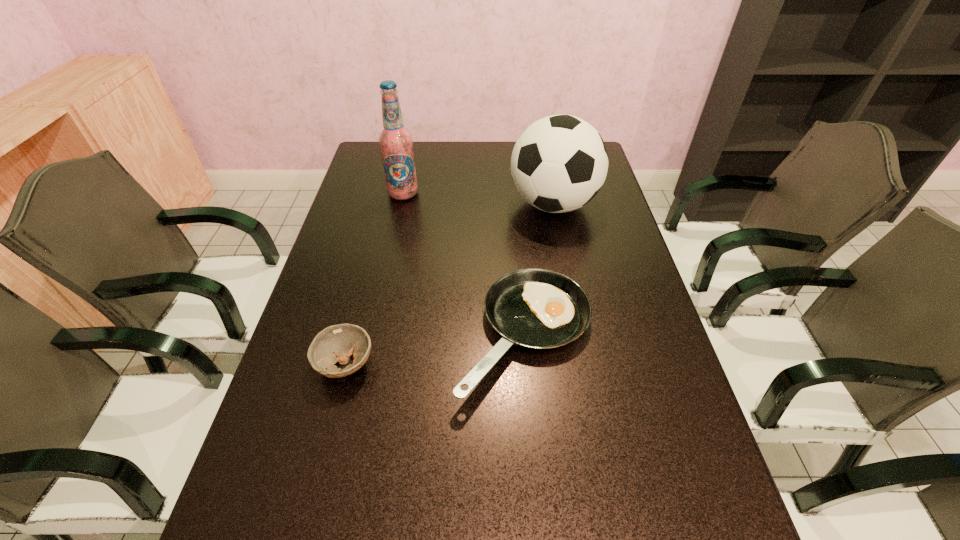
The image size is (960, 540). Find the location of `object that is the third closest to the frying pan`. object that is the third closest to the frying pan is located at coordinates (396, 142).

Locate an element on the screen. The width and height of the screenshot is (960, 540). object that stands as the third closest to the third shortest object is located at coordinates (335, 343).

Locate an element on the screen. This screenshot has height=540, width=960. free space that satisfies the following two spatial constraints: 1. on the back side of the bowl; 2. on the left side of the frying pan is located at coordinates (352, 336).

Identify the location of free region that satisfies the following two spatial constraints: 1. on the back side of the third shortest object; 2. on the right side of the bowl. The width and height of the screenshot is (960, 540). (386, 204).

The height and width of the screenshot is (540, 960). I want to click on free point that satisfies the following two spatial constraints: 1. on the back side of the bowl; 2. on the right side of the alcohol, so click(x=389, y=193).

This screenshot has height=540, width=960. What are the coordinates of `free space that satisfies the following two spatial constraints: 1. on the back side of the third shortest object; 2. on the left side of the frying pan` in the screenshot? It's located at (514, 204).